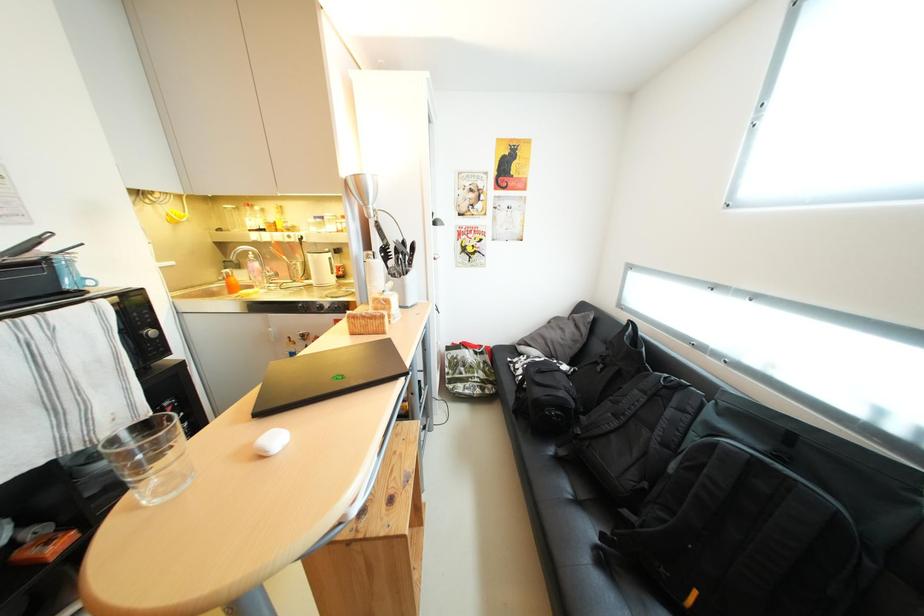
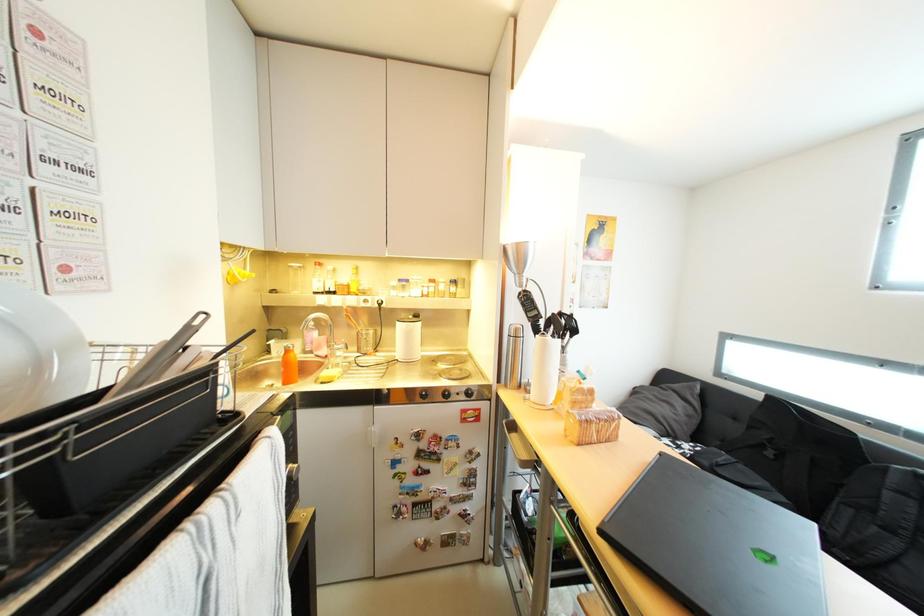
Question: How did the camera likely rotate?

Choices:
 (A) Left
 (B) Right
 (C) Up
 (D) Down

Answer: (C)